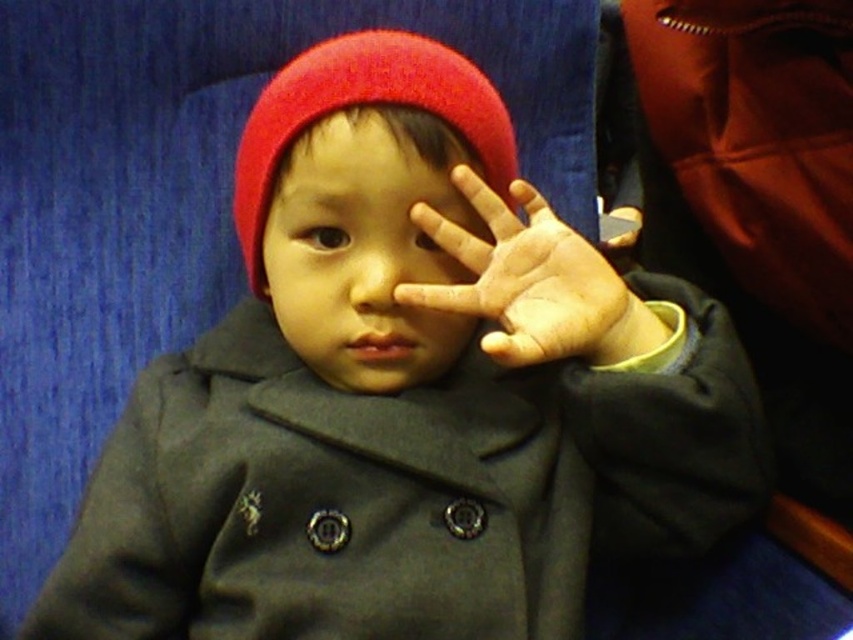
Question: Is matte red beanie at center further to the viewer compared to red woolen hat at center?

Choices:
 (A) yes
 (B) no

Answer: (B)

Question: Considering the real-world distances, which object is farthest from the matte red beanie at center?

Choices:
 (A) dry skin palm at center
 (B) red woolen hat at center

Answer: (B)

Question: Does matte red beanie at center have a greater width compared to dry skin palm at center?

Choices:
 (A) no
 (B) yes

Answer: (A)

Question: Which object is farther from the camera taking this photo?

Choices:
 (A) red woolen hat at center
 (B) matte red beanie at center
 (C) dry skin palm at center

Answer: (A)

Question: Is matte red beanie at center bigger than dry skin palm at center?

Choices:
 (A) yes
 (B) no

Answer: (B)

Question: Which object is the closest to the matte red beanie at center?

Choices:
 (A) dry skin palm at center
 (B) red woolen hat at center

Answer: (A)